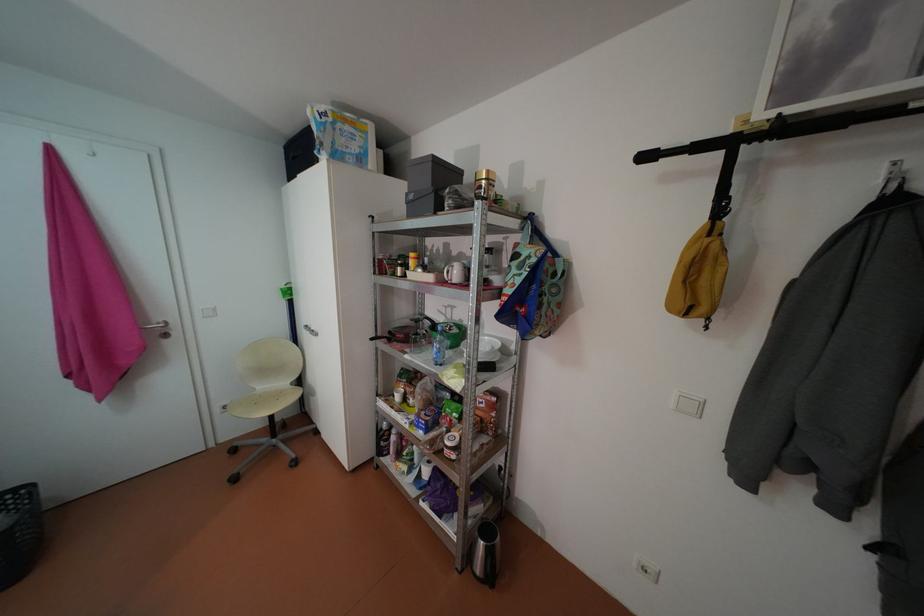
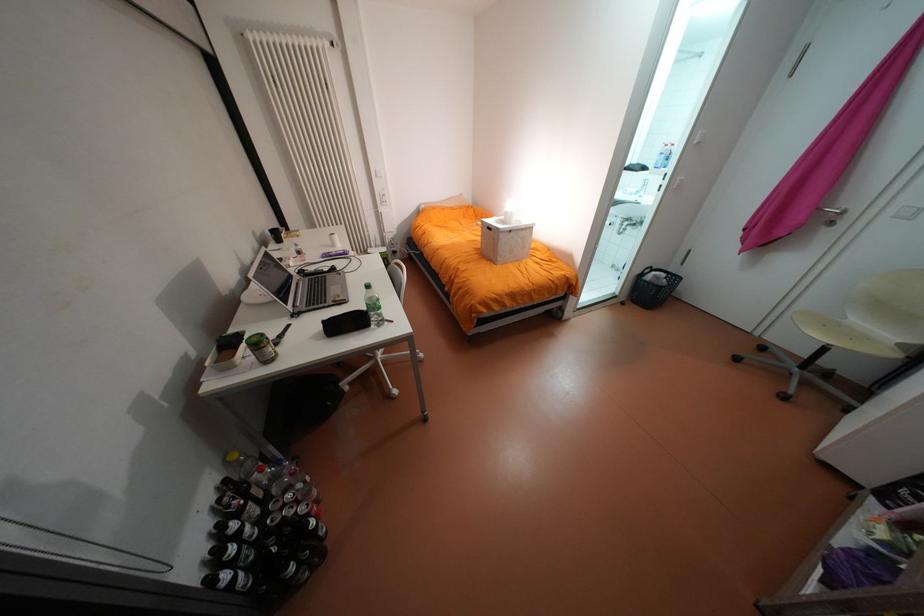
Find the pixel in the second image that matches (x=269, y=400) in the first image.

(840, 323)